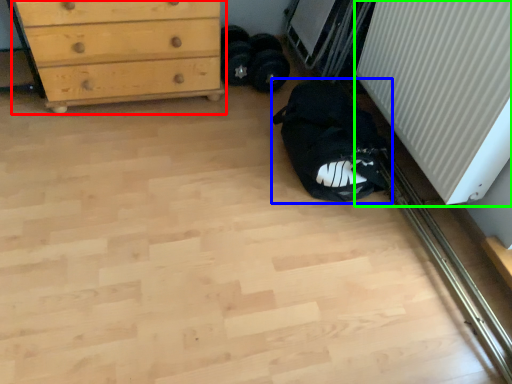
Question: Which object is the farthest from chest of drawers (highlighted by a red box)? Choose among these: sleeping bag (highlighted by a blue box) or radiator (highlighted by a green box).

Choices:
 (A) sleeping bag
 (B) radiator

Answer: (B)